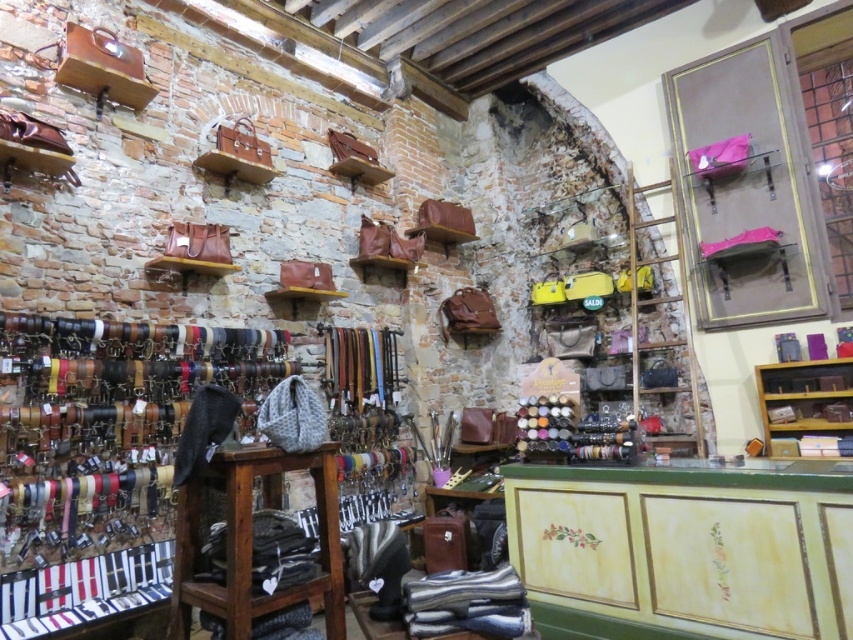
Question: Which point is closer to the camera taking this photo?

Choices:
 (A) (850, 410)
 (B) (329, 570)

Answer: (B)

Question: Among these points, which one is nearest to the camera?

Choices:
 (A) (178, 493)
 (B) (813, 442)

Answer: (A)

Question: Does wooden stool at center appear over wooden shelf at right?

Choices:
 (A) no
 (B) yes

Answer: (A)

Question: Does wooden stool at center appear under wooden shelf at right?

Choices:
 (A) yes
 (B) no

Answer: (A)

Question: Does wooden stool at center have a smaller size compared to wooden shelf at right?

Choices:
 (A) no
 (B) yes

Answer: (A)